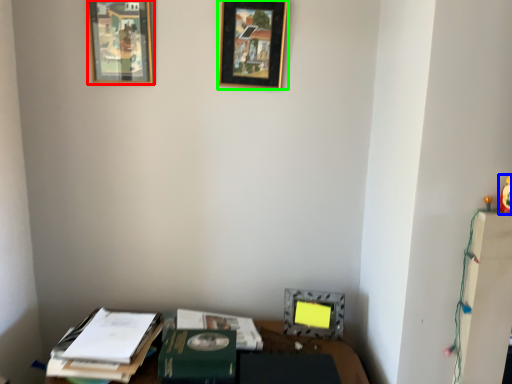
Question: Which object is the farthest from picture frame (highlighted by a red box)? Choose among these: toy (highlighted by a blue box) or picture frame (highlighted by a green box).

Choices:
 (A) toy
 (B) picture frame

Answer: (A)